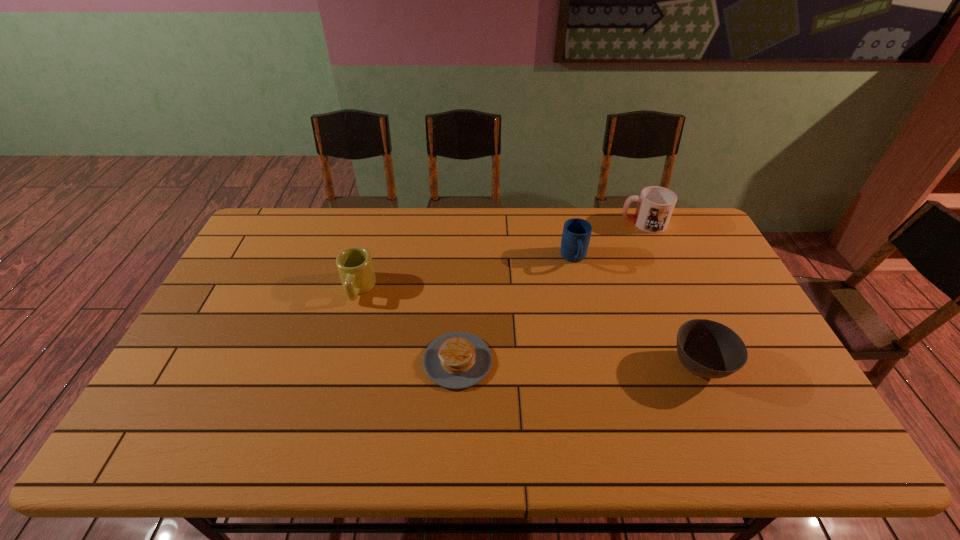
Locate an element on the screen. the farthest object is located at coordinates (655, 205).

This screenshot has height=540, width=960. Identify the location of the rightmost mug. (655, 205).

Where is `the third object from right to left`? The height and width of the screenshot is (540, 960). the third object from right to left is located at coordinates (576, 234).

The width and height of the screenshot is (960, 540). I want to click on the leftmost object, so click(x=354, y=264).

Locate an element on the screen. This screenshot has width=960, height=540. bowl is located at coordinates (708, 349).

Locate an element on the screen. pancake is located at coordinates pyautogui.click(x=457, y=360).

At what (x,y) coordinates should I click in order to perform the action: click on the shortest object. Please return your answer as a coordinate pair (x, y). Looking at the image, I should click on (457, 360).

Locate an element on the screen. This screenshot has width=960, height=540. free space located 0.060m on the side of the farthest object with the handle is located at coordinates (604, 223).

You are a GUI agent. You are given a task and a screenshot of the screen. Output one action in this format:
    pyautogui.click(x=<x>, y=<y>)
    Task: Click on the vacant space located 0.340m on the side of the farthest object with the handle
    This screenshot has height=540, width=960.
    Given the screenshot: What is the action you would take?
    pyautogui.click(x=527, y=223)

Locate an element on the screen. This screenshot has height=540, width=960. free space located 0.160m on the side of the farthest object with the handle is located at coordinates (576, 223).